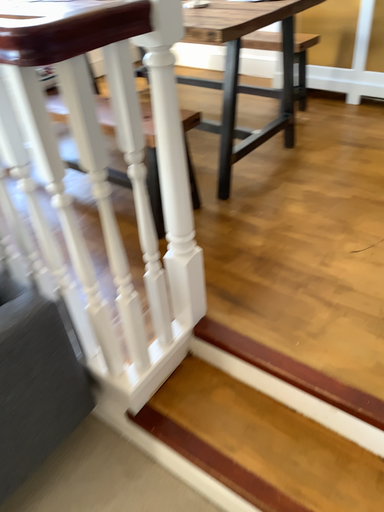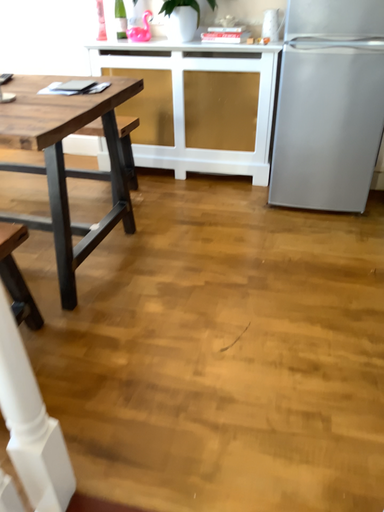
Question: How did the camera likely rotate when shooting the video?

Choices:
 (A) rotated downward
 (B) rotated upward

Answer: (B)